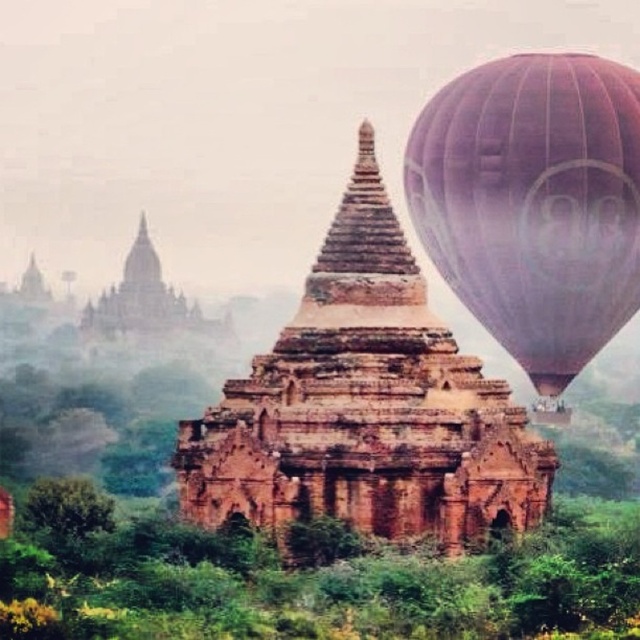
Which is behind, point (445, 333) or point (564, 307)?

The point (445, 333) is behind.

Between point (221, 419) and point (580, 212), which one is positioned in front?

Point (580, 212)

Describe the element at coordinates (365, 406) in the screenshot. I see `reddish-brown stone temple at center` at that location.

Locate an element on the screen. Image resolution: width=640 pixels, height=640 pixels. reddish-brown stone temple at center is located at coordinates (365, 406).